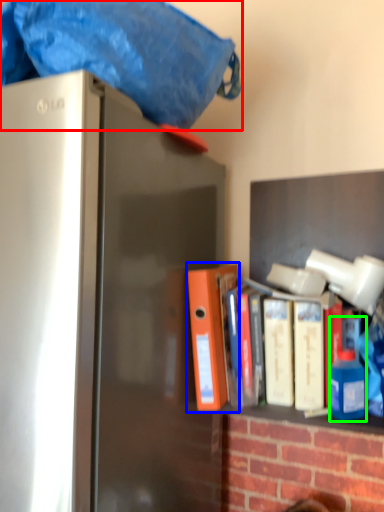
Question: Considering the real-world distances, which object is closest to blanket (highlighted by a red box)? book (highlighted by a blue box) or bottle (highlighted by a green box).

Choices:
 (A) book
 (B) bottle

Answer: (A)